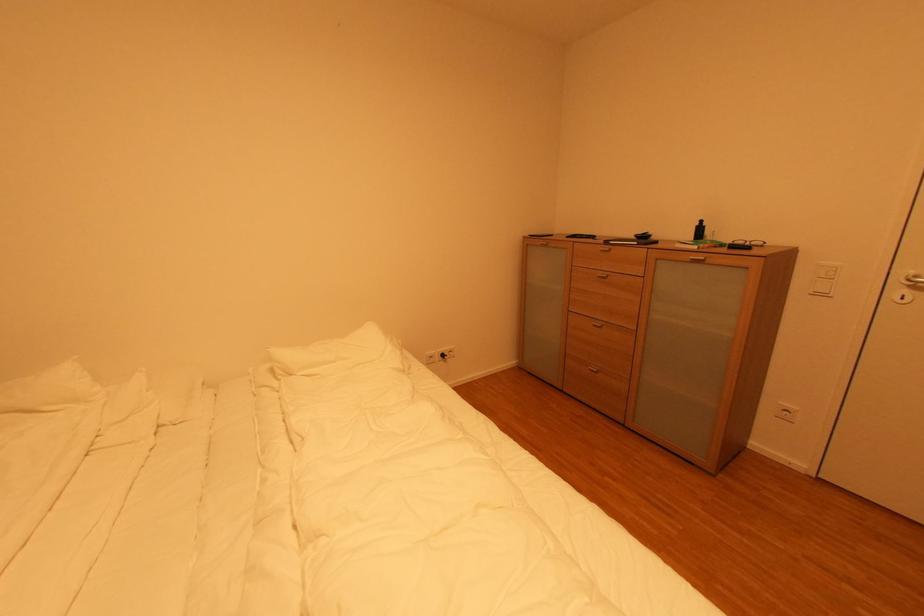
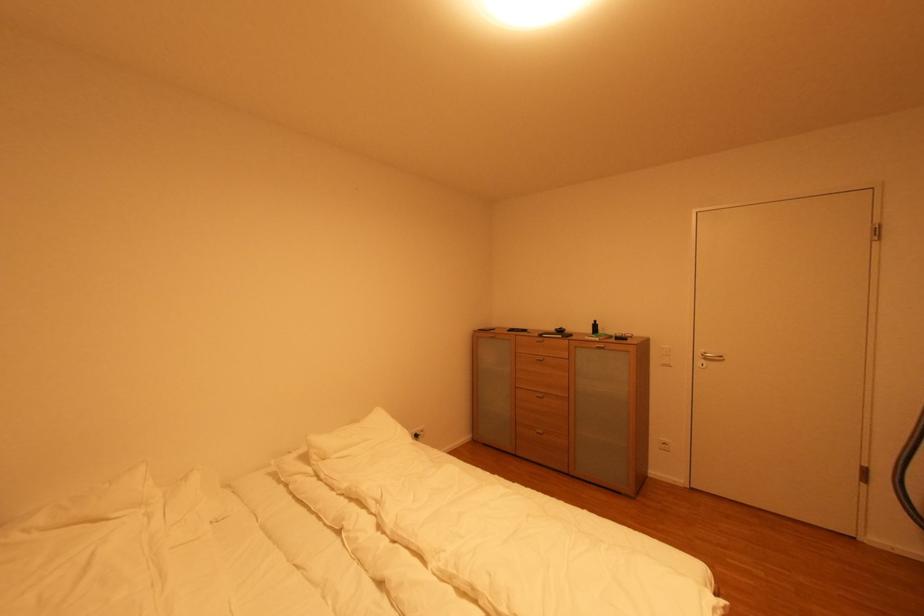
Locate, in the second image, the point that corresponds to point (823, 294) in the first image.

(670, 367)